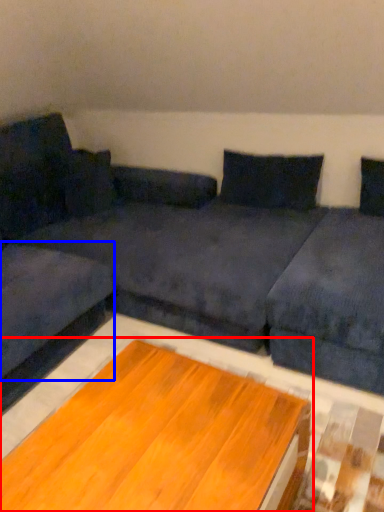
Question: Which object is further to the camera taking this photo, table (highlighted by a red box) or couch (highlighted by a blue box)?

Choices:
 (A) table
 (B) couch

Answer: (B)